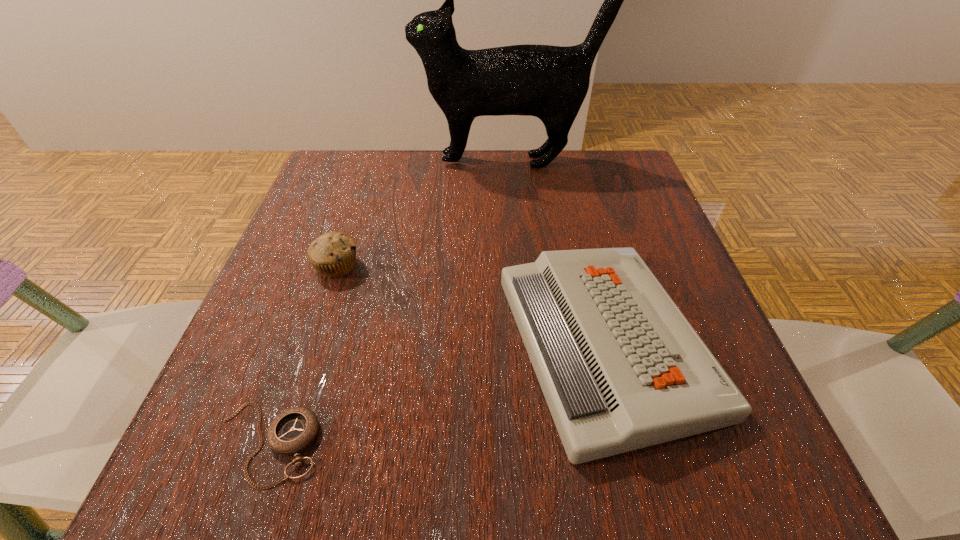
Where is `free space at the near edge`? free space at the near edge is located at coordinates (636, 488).

In the image, there is a desktop. Where is `free space at the left edge`? This screenshot has width=960, height=540. free space at the left edge is located at coordinates (345, 301).

Find the location of `vacant space at the right edge`. vacant space at the right edge is located at coordinates (601, 229).

In the image, there is a desktop. At what (x,y) coordinates should I click in order to perform the action: click on vacant region at the far left corner. Please return your answer as a coordinate pair (x, y). Looking at the image, I should click on (334, 152).

In the image, there is a desktop. Identify the location of free space at the near left corner. (223, 488).

This screenshot has width=960, height=540. In order to click on free space at the far right corner of the desktop in this screenshot , I will do `click(598, 165)`.

This screenshot has height=540, width=960. Find the location of `free region at the near right corner of the desktop`. free region at the near right corner of the desktop is located at coordinates (738, 480).

Find the location of `free point between the shortest object and the computer keyboard`. free point between the shortest object and the computer keyboard is located at coordinates (437, 393).

Find the location of a particular element. Image resolution: width=960 pixels, height=540 pixels. free space between the muffin and the pocket watch is located at coordinates 302,355.

Find the location of a particular element. This screenshot has width=960, height=540. free area in between the muffin and the tallest object is located at coordinates (424, 214).